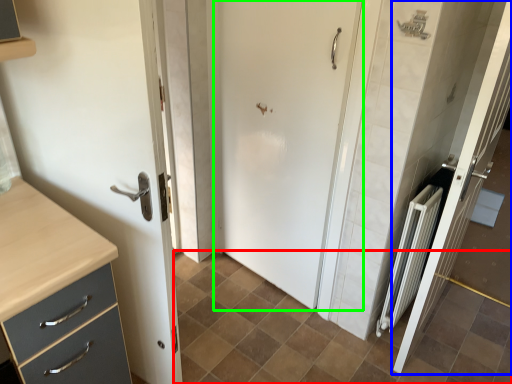
Question: Which object is the closest to the ceramic tile (highlighted by a red box)? Choose among these: door (highlighted by a blue box) or door (highlighted by a green box).

Choices:
 (A) door
 (B) door

Answer: (A)